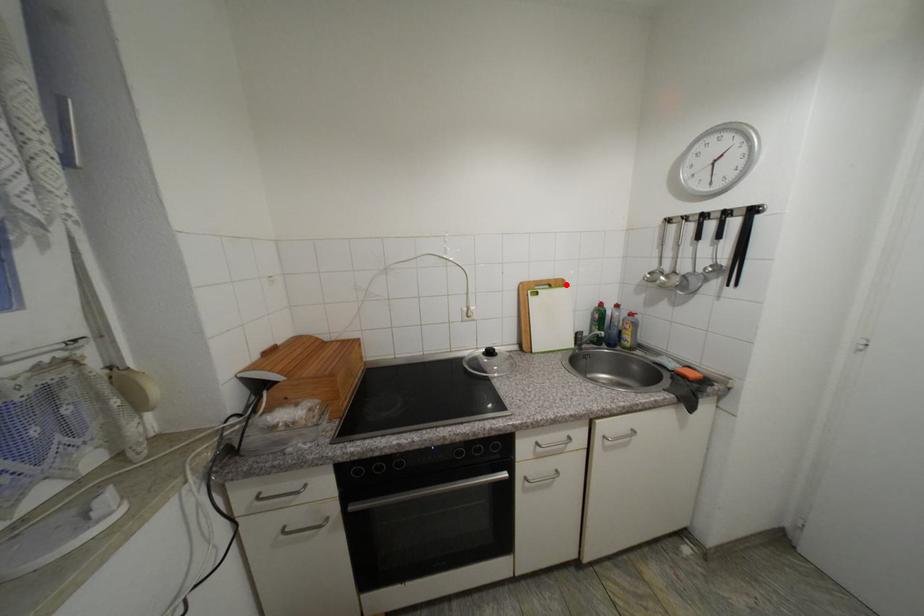
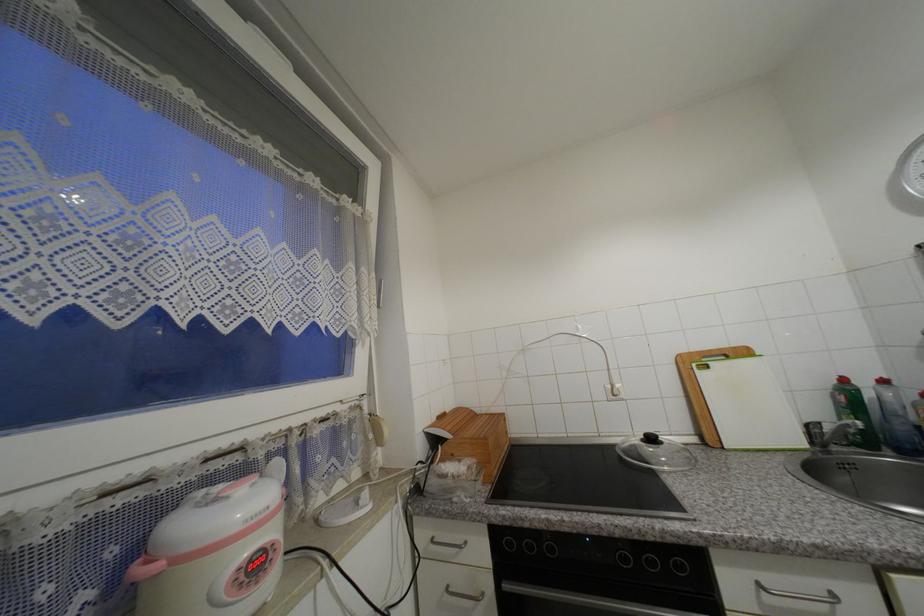
The point at the highlighted location is marked in the first image. Where is the corresponding point in the second image?

(749, 354)